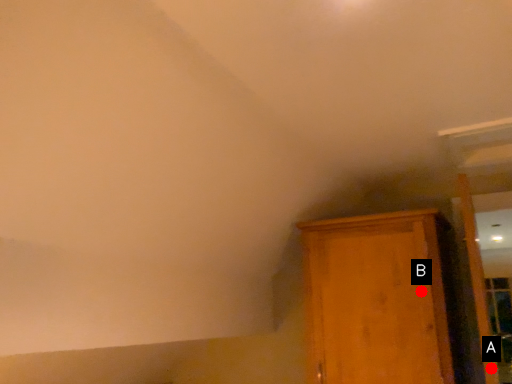
Question: Two points are circled on the image, labeled by A and B beside each circle. Which point appears closest to the camera in this image?

Choices:
 (A) A is closer
 (B) B is closer

Answer: (B)